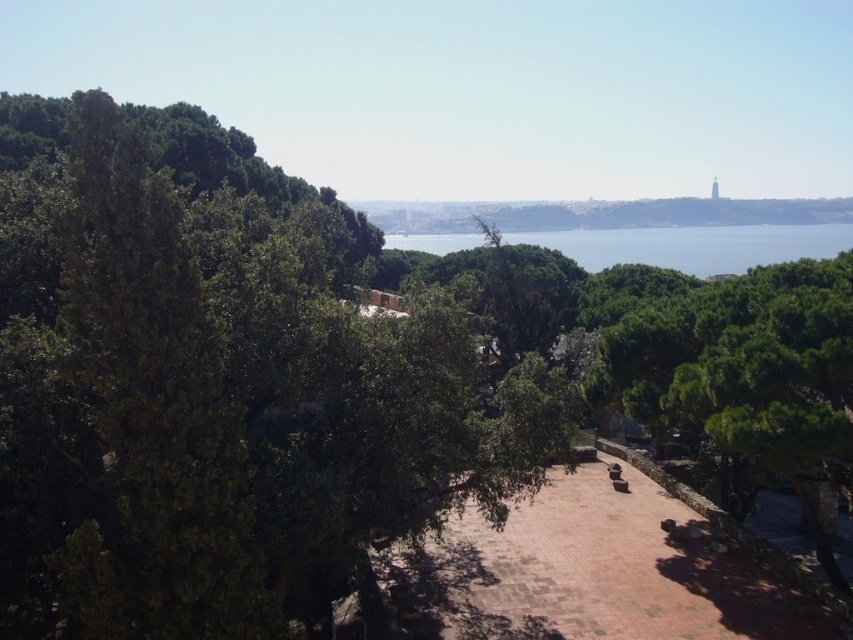
Is brown stone path at center thinner than clear blue water at center?

Yes.

Between point (573, 490) and point (691, 230), which one is positioned in front?

Point (573, 490) is in front.

Find the location of a particular element. The height and width of the screenshot is (640, 853). brown stone path at center is located at coordinates (596, 573).

Does green leafy tree at center appear over brown stone path at center?

Indeed, green leafy tree at center is positioned over brown stone path at center.

Does point (183, 579) come farther from viewer compared to point (624, 618)?

No, (183, 579) is closer to viewer.

The height and width of the screenshot is (640, 853). Find the location of `green leafy tree at center`. green leafy tree at center is located at coordinates (219, 406).

Is green leafy tree at center positioned behind green leafy hillside at center?

No, it is not.

Is point (184, 385) positioned after point (601, 221)?

No, (184, 385) is closer to viewer.

Is point (42, 461) positioned before point (453, 216)?

Yes, it is in front of point (453, 216).

Where is `green leafy tree at center`? This screenshot has height=640, width=853. green leafy tree at center is located at coordinates (219, 406).